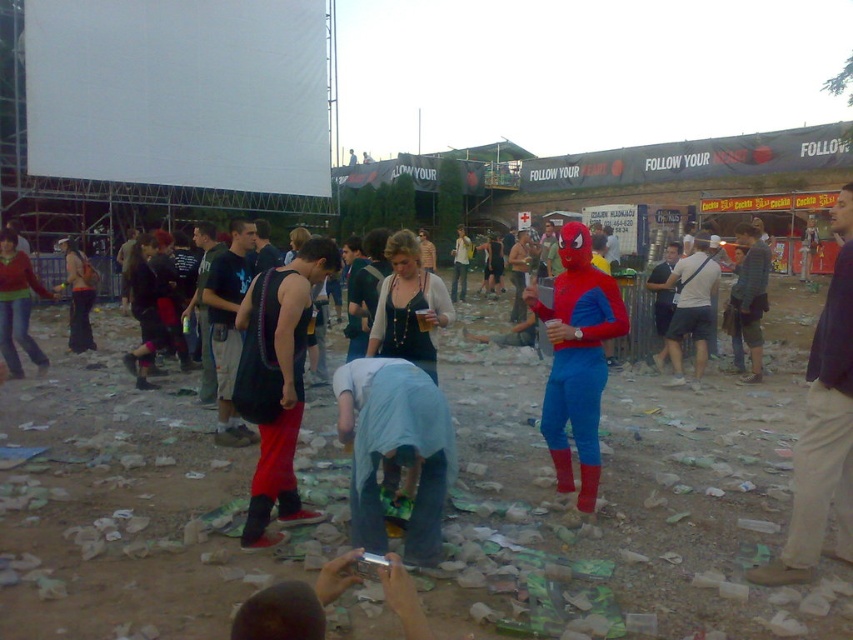
You are at the music festival and see two people wearing denim jeans at center and denim shorts at center. Which one is more to the left?

The denim jeans at center is more to the left than the denim shorts at center.

You are standing at the music festival and want to reach a specific point to set up a small booth. The point you need to reach is located at coordinates point (843,484). If your booth requires a minimum of 3 meters of space from the front to the back, will this point provide enough space for your booth?

The distance of point (843,484) from the viewer is 3.74 meters. Since the required space is 3 meters, the point provides sufficient space for the booth as 3.74 meters is greater than 3 meters.

You are organizing a charity clothing drive and need to decide which item to place in a narrow donation box. The denim jeans at center and the denim shorts at center are both available. Which one can fit better into the box if the box is designed to accommodate thinner items?

The denim jeans at center is thinner than denim shorts at center, so the denim jeans at center can fit better into the narrow donation box.